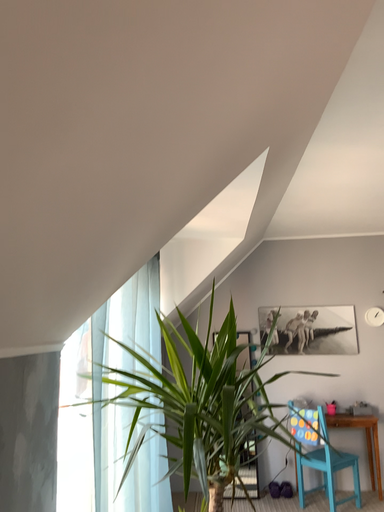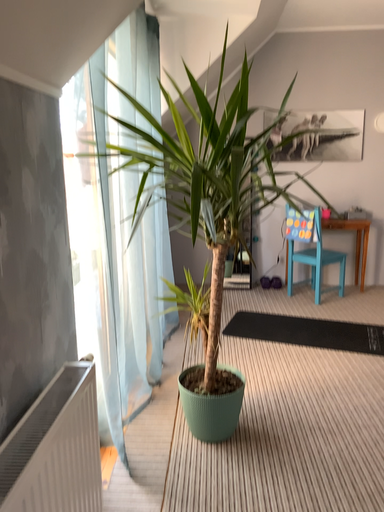
Question: How did the camera likely rotate when shooting the video?

Choices:
 (A) rotated downward
 (B) rotated upward

Answer: (A)